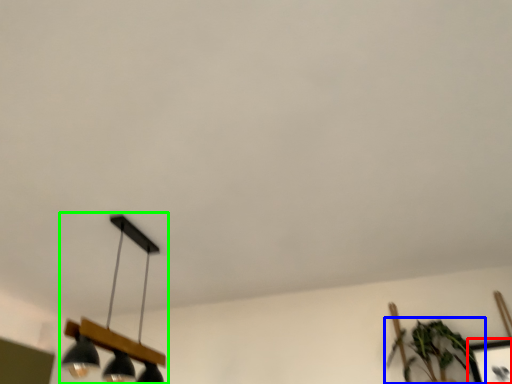
Question: Estimate the real-world distances between objects in this image. Which object is closer to picture frame (highlighted by a red box), houseplant (highlighted by a blue box) or lamp (highlighted by a green box)?

Choices:
 (A) houseplant
 (B) lamp

Answer: (A)